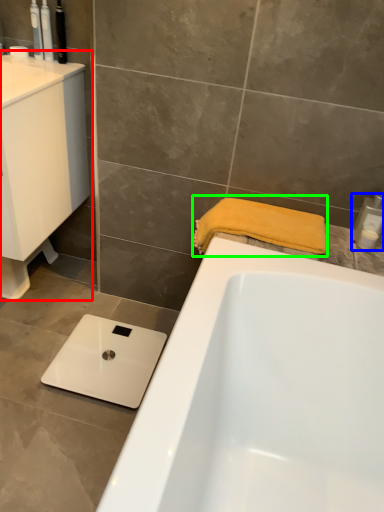
Question: Which object is positioned closest to sink (highlighted by a red box)? Select from toiletry (highlighted by a blue box) and bath towel (highlighted by a green box).

Choices:
 (A) toiletry
 (B) bath towel

Answer: (B)